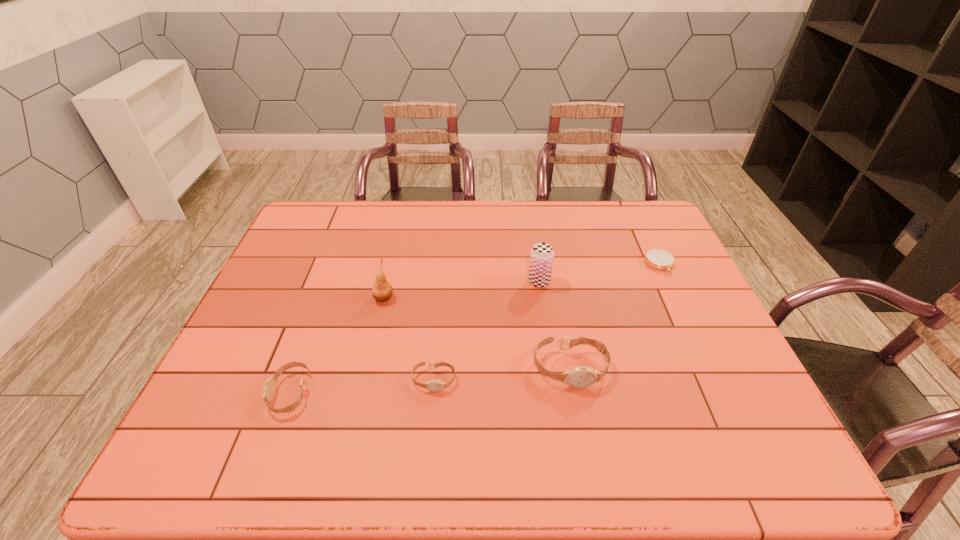
This screenshot has height=540, width=960. In order to click on the third shortest object in this screenshot , I will do (269, 389).

The image size is (960, 540). Identify the location of the second tallest watch. (269, 389).

Identify the location of the shortest watch. The width and height of the screenshot is (960, 540). (434, 385).

Find the location of a particular element. the second shortest object is located at coordinates (434, 385).

Find the location of a particular element. the fourth shortest object is located at coordinates (579, 377).

Where is `the rightmost watch`? the rightmost watch is located at coordinates (579, 377).

You are a GUI agent. You are given a task and a screenshot of the screen. Output one action in this format:
    pyautogui.click(x=<x>, y=<y>)
    Task: Click on the compass
    The width and height of the screenshot is (960, 540).
    Given the screenshot: What is the action you would take?
    pyautogui.click(x=659, y=259)

This screenshot has height=540, width=960. I want to click on the shortest object, so click(659, 259).

The image size is (960, 540). In order to click on beer can in this screenshot , I will do `click(542, 254)`.

Locate an element on the screen. the third farthest object is located at coordinates (382, 290).